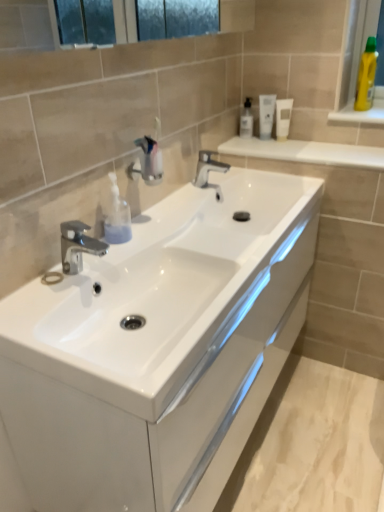
You are a GUI agent. You are given a task and a screenshot of the screen. Output one action in this format:
    pyautogui.click(x=<x>, y=<y>)
    Task: Click on the vacant area that is situated to the right of translucent plastic soap dispenser at center, placed as the second toiletry when sorted from top to bottom
    
    Given the screenshot: What is the action you would take?
    pyautogui.click(x=162, y=237)